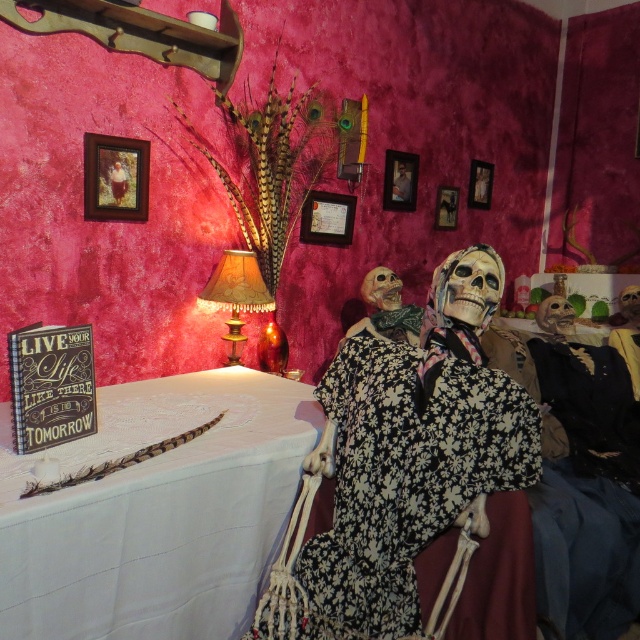
Measure the distance between black floral fabric dress at center and leather textured lampshade at center.

black floral fabric dress at center is 3.61 feet away from leather textured lampshade at center.

Does black floral fabric dress at center have a greater width compared to leather textured lampshade at center?

Correct, the width of black floral fabric dress at center exceeds that of leather textured lampshade at center.

Is point (509, 442) more distant than point (227, 339)?

No, it is not.

You are a GUI agent. You are given a task and a screenshot of the screen. Output one action in this format:
    pyautogui.click(x=<x>, y=<y>)
    Task: Click on the black floral fabric dress at center
    This screenshot has width=640, height=640.
    Given the screenshot: What is the action you would take?
    pyautogui.click(x=403, y=480)

Who is positioned more to the right, black floral fabric dress at center or smooth wooden frame at upper center?

From the viewer's perspective, smooth wooden frame at upper center appears more on the right side.

What do you see at coordinates (403, 480) in the screenshot? I see `black floral fabric dress at center` at bounding box center [403, 480].

Measure the distance between black floral fabric dress at center and camera.

black floral fabric dress at center and camera are 1.50 meters apart from each other.

Find the location of a particular element. black floral fabric dress at center is located at coordinates (403, 480).

Is point (138, 493) farther from viewer compared to point (241, 280)?

No, it is in front of (241, 280).

Is white lace tablecloth at upper left taller than leather textured lampshade at center?

Yes, white lace tablecloth at upper left is taller than leather textured lampshade at center.

Does point (268, 474) come farther from viewer compared to point (241, 355)?

That is False.

Identify the location of white lace tablecloth at upper left. The image size is (640, 640). (156, 513).